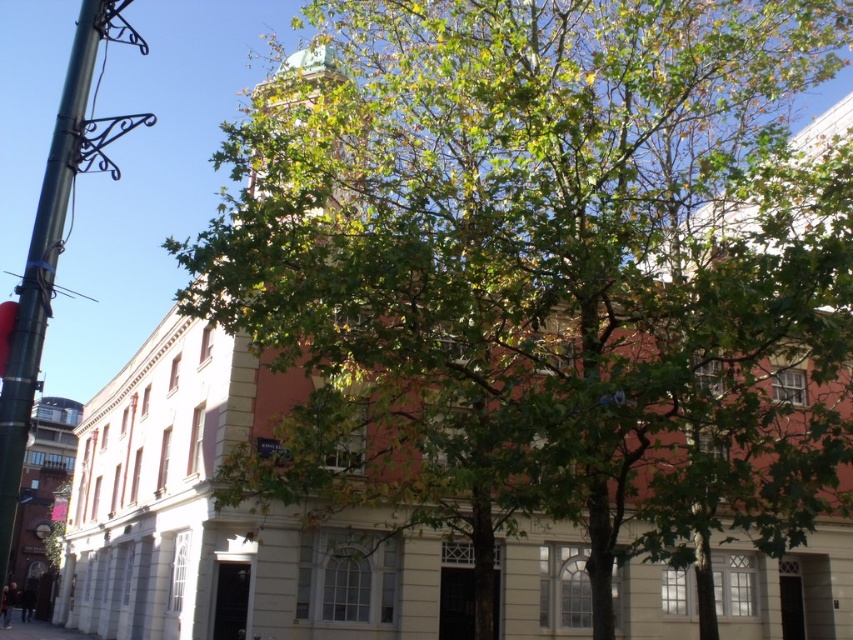
Is point (78, 19) closer to viewer compared to point (7, 628)?

Yes.

Image resolution: width=853 pixels, height=640 pixels. I want to click on green metallic pole at left, so click(44, 266).

This screenshot has width=853, height=640. What do you see at coordinates (44, 266) in the screenshot? I see `green metallic pole at left` at bounding box center [44, 266].

You are a GUI agent. You are given a task and a screenshot of the screen. Output one action in this format:
    pyautogui.click(x=<x>, y=<y>)
    Task: Click on the green metallic pole at left
    This screenshot has height=640, width=853.
    Given the screenshot: What is the action you would take?
    pyautogui.click(x=44, y=266)

From the picture: Between green metallic pole at left and green copper dome at center, which one has more height?

With more height is green metallic pole at left.

Between point (68, 157) and point (263, 84), which one is positioned in front?

Point (68, 157)

The height and width of the screenshot is (640, 853). What are the coordinates of `green metallic pole at left` in the screenshot? It's located at (44, 266).

Is green copper dome at center below concrete pavement at lower left?

Actually, green copper dome at center is above concrete pavement at lower left.

Who is positioned more to the right, green copper dome at center or concrete pavement at lower left?

green copper dome at center is more to the right.

Who is more forward, (283,76) or (70,637)?

Point (283,76) is in front.

Identify the location of green copper dome at center. (300, 83).